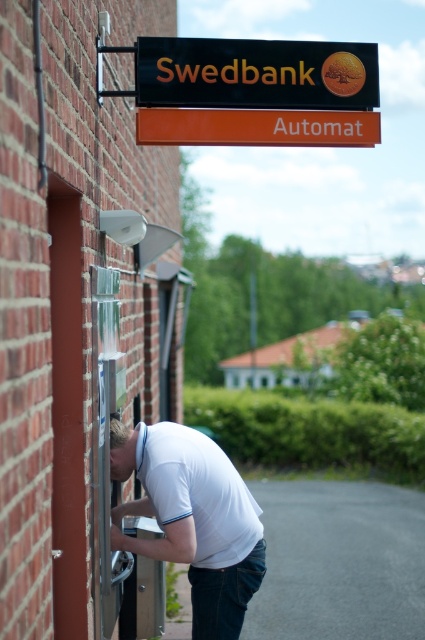
Is white matte shirt at center closer to camera compared to black plastic sign at upper center?

Yes, it is in front of black plastic sign at upper center.

Does point (255, 544) come closer to viewer compared to point (249, 80)?

That is True.

Where is `white matte shirt at center`? white matte shirt at center is located at coordinates (192, 518).

Which is more to the left, black plastic sign at upper center or orange plastic sign at upper center?

black plastic sign at upper center

Between black plastic sign at upper center and orange plastic sign at upper center, which one has less height?

orange plastic sign at upper center is shorter.

Is point (193, 92) positioned before point (198, 112)?

Yes, it is.

The width and height of the screenshot is (425, 640). In order to click on black plastic sign at upper center in this screenshot , I will do `click(255, 74)`.

Between white matte shirt at center and orange plastic sign at upper center, which one appears on the left side from the viewer's perspective?

white matte shirt at center is more to the left.

Does point (195, 552) lie in front of point (357, 134)?

Yes, it is in front of point (357, 134).

At what (x,y) coordinates should I click in order to perform the action: click on white matte shirt at center. Please return your answer as a coordinate pair (x, y). Looking at the image, I should click on (192, 518).